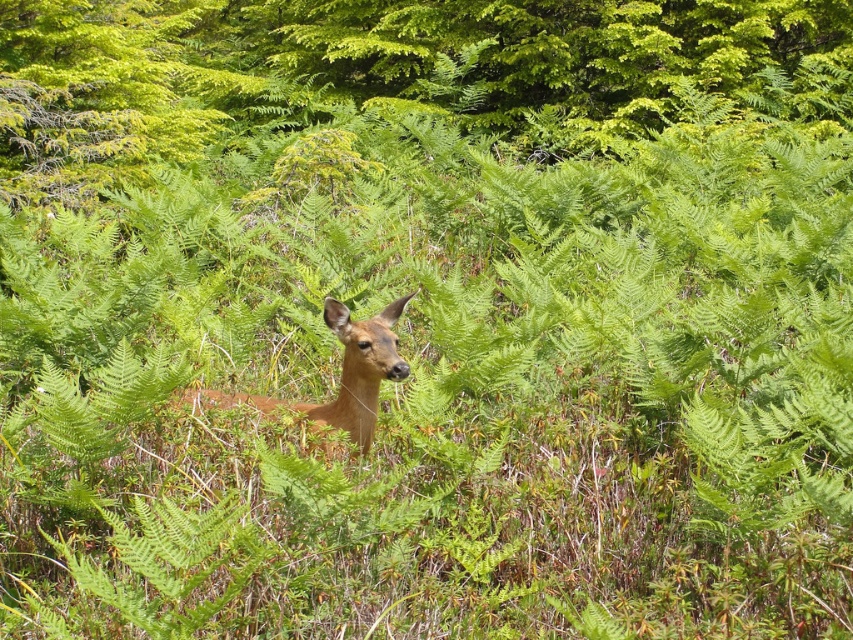
Describe the element at coordinates (376, 70) in the screenshot. The height and width of the screenshot is (640, 853). I see `green leafy tree at center` at that location.

Is green leafy tree at center positioned before brown matte/deer at center?

No.

Does point (61, 132) come behind point (331, 314)?

Yes, it is.

The height and width of the screenshot is (640, 853). I want to click on green leafy tree at center, so click(376, 70).